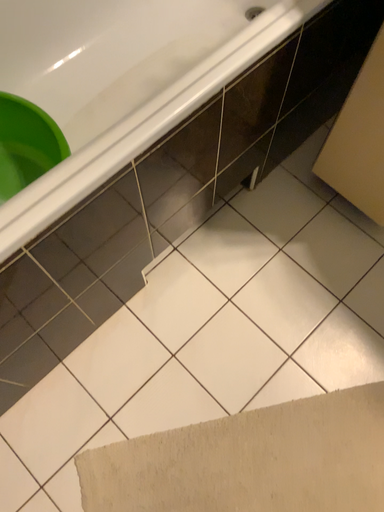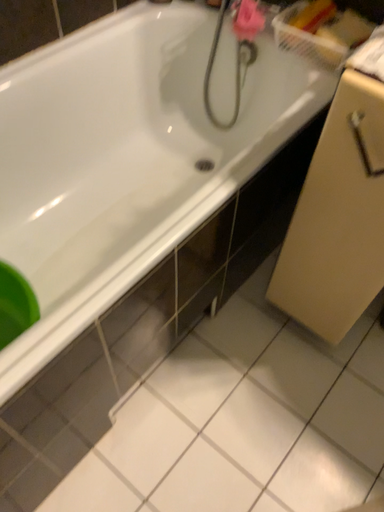
Question: Which way did the camera rotate in the video?

Choices:
 (A) rotated upward
 (B) rotated downward

Answer: (A)